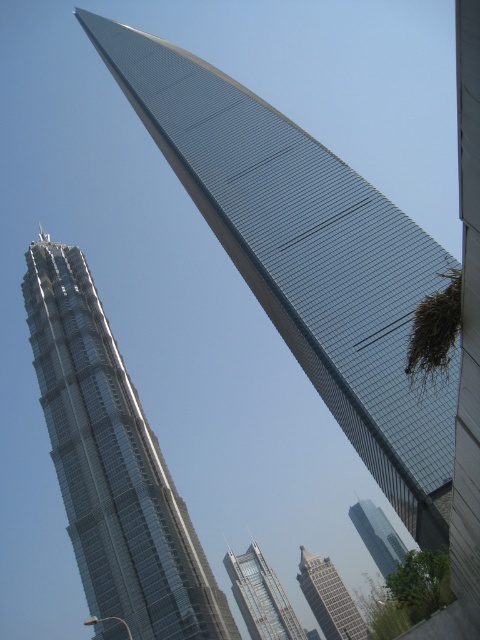
Does clear glass skyscraper at center appear on the right side of gray glass building at center?

No, clear glass skyscraper at center is not to the right of gray glass building at center.

Between clear glass skyscraper at center and gray glass building at center, which one is positioned higher?

clear glass skyscraper at center

I want to click on clear glass skyscraper at center, so click(261, 596).

The image size is (480, 640). I want to click on clear glass skyscraper at center, so click(261, 596).

Which is in front, point (71, 339) or point (257, 550)?

Positioned in front is point (71, 339).

Who is higher up, shiny silver skyscraper at left or clear glass skyscraper at center?

shiny silver skyscraper at left is higher up.

Who is more forward, (83, 557) or (255, 612)?

Point (83, 557) is in front.

You are a GUI agent. You are given a task and a screenshot of the screen. Output one action in this format:
    pyautogui.click(x=<x>, y=<y>)
    Task: Click on the shiny silver skyscraper at left
    This screenshot has height=640, width=480.
    Given the screenshot: What is the action you would take?
    pyautogui.click(x=112, y=465)

Which is in front, point (264, 572) or point (372, 532)?

Point (264, 572) is more forward.

Can you confirm if clear glass skyscraper at center is shorter than green glass skyscraper at center?

Indeed, clear glass skyscraper at center has a lesser height compared to green glass skyscraper at center.

The height and width of the screenshot is (640, 480). What do you see at coordinates (261, 596) in the screenshot?
I see `clear glass skyscraper at center` at bounding box center [261, 596].

Locate an element on the screen. clear glass skyscraper at center is located at coordinates (261, 596).